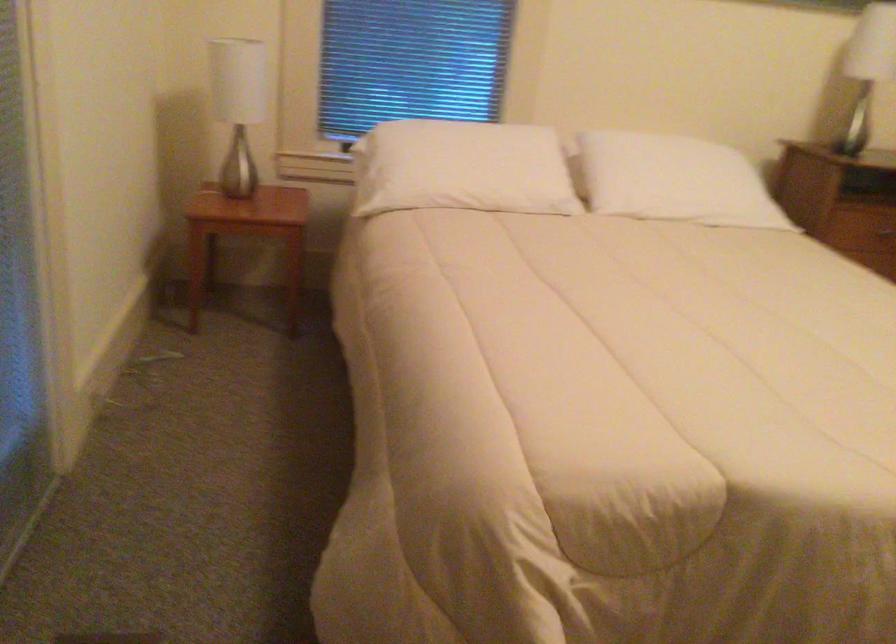
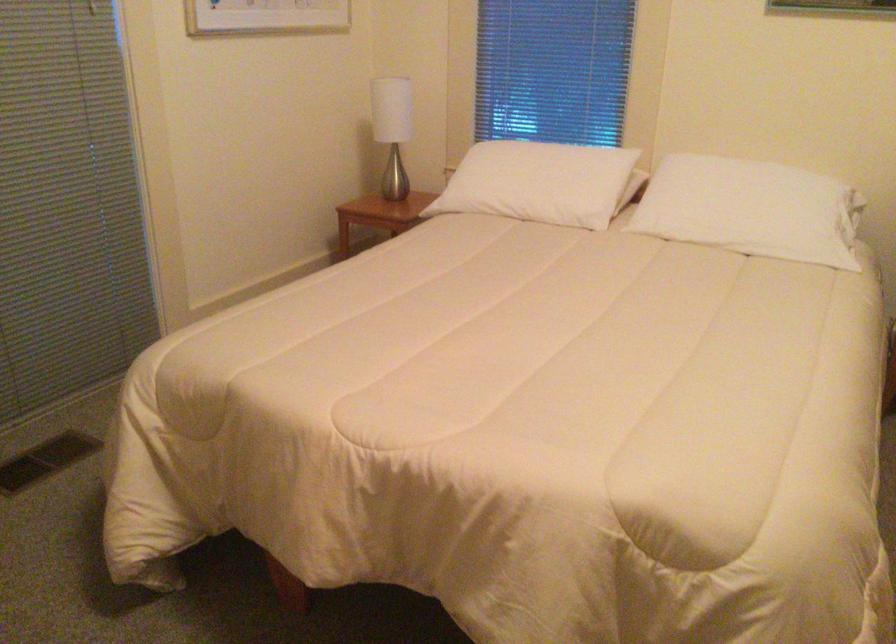
Locate, in the second image, the point that corresponds to point (495, 167) in the first image.

(538, 183)